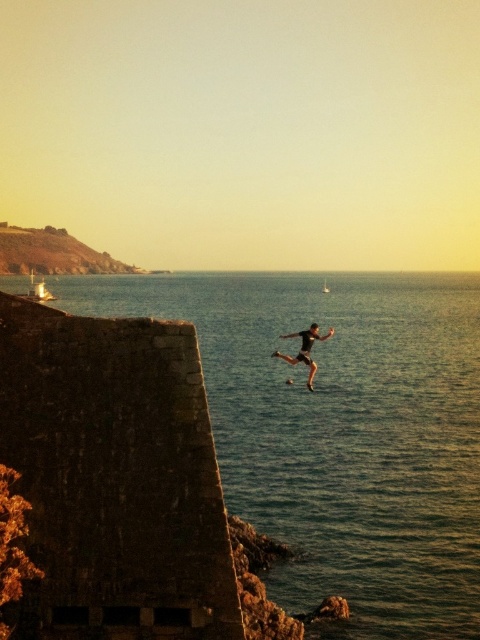
Is point (399, 340) positioned behind point (302, 342)?

Yes, it is.

Between blue water at center and dark skin/athletic wear person at center, which one appears on the left side from the viewer's perspective?

dark skin/athletic wear person at center

Who is more distant from viewer, (255, 294) or (310, 380)?

The point (255, 294) is more distant.

Find the location of a particular element. Image resolution: width=480 pixels, height=640 pixels. blue water at center is located at coordinates (346, 428).